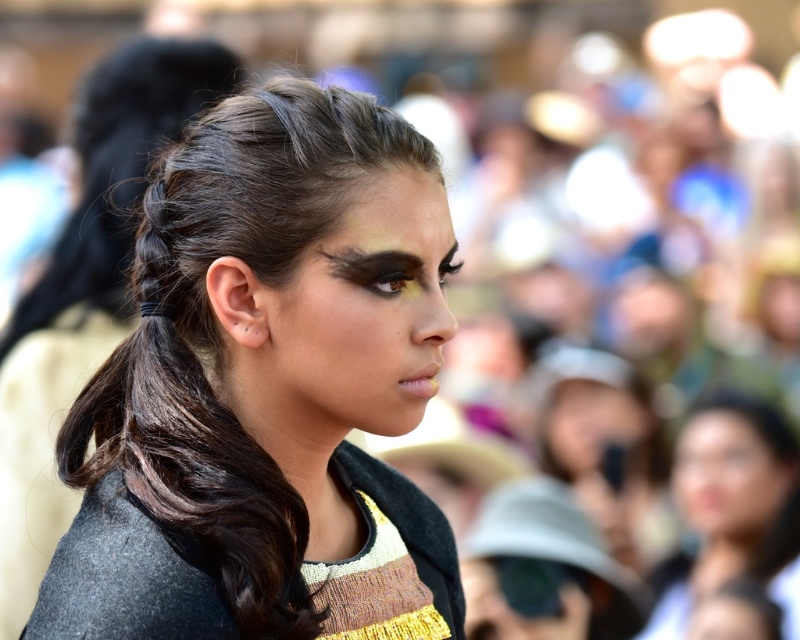
Is dark brown braided hair at center wider than brown matte eye at center?

Yes.

Find the location of a particular element. dark brown braided hair at center is located at coordinates (120, 168).

Image resolution: width=800 pixels, height=640 pixels. Identify the location of dark brown braided hair at center. (120, 168).

Can you confirm if matte skin at center is thinner than dark brown hair at upper center?

No, matte skin at center is not thinner than dark brown hair at upper center.

Between point (362, 228) and point (389, 266), which one is positioned behind?

The point (389, 266) is behind.

Locate an element on the screen. matte skin at center is located at coordinates (389, 228).

Is matte skin at center behind smooth skin face at lower right?

That is False.

Between matte skin at center and smooth skin face at lower right, which one appears on the right side from the viewer's perspective?

smooth skin face at lower right

Find the location of a particular element. matte skin at center is located at coordinates (389, 228).

Locate an element on the screen. The width and height of the screenshot is (800, 640). matte skin at center is located at coordinates (389, 228).